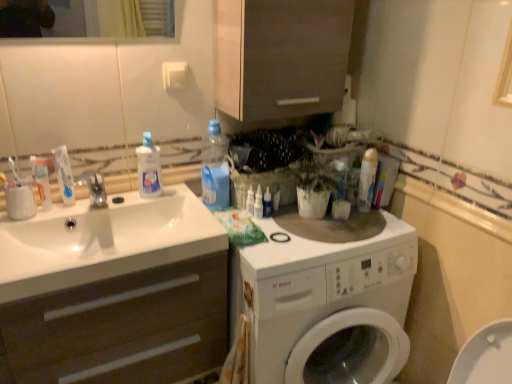
Question: Is white glossy bottle at center, which ranks as the first toiletry in right-to-left order, completely or partially outside of transparent plastic spray bottle at center, the 2th cleaning product when ordered from right to left?

Choices:
 (A) yes
 (B) no

Answer: (A)

Question: Is white glossy bottle at center, which ranks as the 3th toiletry in left-to-right order, aimed at transparent plastic spray bottle at center, which appears as the 3th cleaning product when viewed from the left?

Choices:
 (A) no
 (B) yes

Answer: (A)

Question: Is white glossy bottle at center, which ranks as the 3th toiletry in left-to-right order, shorter than transparent plastic spray bottle at center, the 2th cleaning product when ordered from right to left?

Choices:
 (A) no
 (B) yes

Answer: (B)

Question: Is white glossy bottle at center, which ranks as the 3th toiletry in left-to-right order, taller than transparent plastic spray bottle at center, which appears as the 3th cleaning product when viewed from the left?

Choices:
 (A) no
 (B) yes

Answer: (A)

Question: Can you confirm if white glossy bottle at center, which ranks as the 3th toiletry in left-to-right order, is positioned to the right of transparent plastic spray bottle at center, the 2th cleaning product when ordered from right to left?

Choices:
 (A) no
 (B) yes

Answer: (B)

Question: Based on their sizes in the image, would you say white matte cabinet at left is bigger or smaller than white glossy toothpaste at left, the 1th toothpaste when ordered from right to left?

Choices:
 (A) big
 (B) small

Answer: (A)

Question: From a real-world perspective, is white matte cabinet at left physically located above or below white glossy toothpaste at left, which appears as the second toothpaste when viewed from the left?

Choices:
 (A) below
 (B) above

Answer: (A)

Question: From the image's perspective, is white matte cabinet at left above or below white glossy toothpaste at left, which appears as the second toothpaste when viewed from the left?

Choices:
 (A) below
 (B) above

Answer: (A)

Question: Do you think white matte cabinet at left is within white glossy toothpaste at left, which appears as the second toothpaste when viewed from the left, or outside of it?

Choices:
 (A) outside
 (B) inside

Answer: (A)

Question: From a real-world perspective, is white glossy bottle at center, placed as the 2th toiletry when sorted from right to left, positioned above or below blue plastic bottle at upper center, the second cleaning product in the left-to-right sequence?

Choices:
 (A) below
 (B) above

Answer: (A)

Question: Considering the positions of white glossy bottle at center, placed as the 2th toiletry when sorted from right to left, and blue plastic bottle at upper center, positioned as the 3th cleaning product in right-to-left order, in the image, is white glossy bottle at center, placed as the 2th toiletry when sorted from right to left, bigger or smaller than blue plastic bottle at upper center, positioned as the 3th cleaning product in right-to-left order,?

Choices:
 (A) small
 (B) big

Answer: (A)

Question: Visually, is white glossy bottle at center, which is counted as the second toiletry, starting from the left, positioned to the left or to the right of blue plastic bottle at upper center, the second cleaning product in the left-to-right sequence?

Choices:
 (A) right
 (B) left

Answer: (A)

Question: Looking at their shapes, would you say white glossy bottle at center, which is counted as the second toiletry, starting from the left, is wider or thinner than blue plastic bottle at upper center, positioned as the 3th cleaning product in right-to-left order?

Choices:
 (A) thin
 (B) wide

Answer: (A)

Question: Is white glossy toothpaste at sink, marked as the first toothpaste in a left-to-right arrangement, wider or thinner than white matte cabinet at left?

Choices:
 (A) thin
 (B) wide

Answer: (A)

Question: From the image's perspective, is white glossy toothpaste at sink, marked as the first toothpaste in a left-to-right arrangement, above or below white matte cabinet at left?

Choices:
 (A) below
 (B) above

Answer: (B)